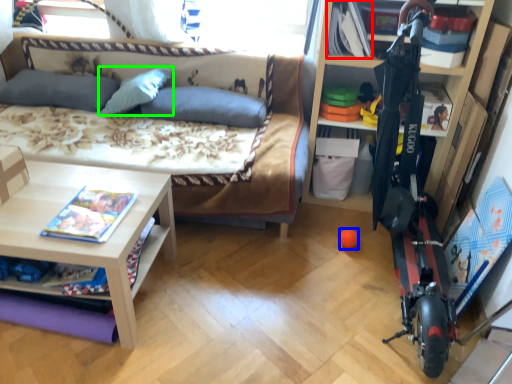
Question: Which is nearer to the book (highlighted by a red box)? toy (highlighted by a blue box) or pillow (highlighted by a green box).

Choices:
 (A) toy
 (B) pillow

Answer: (A)